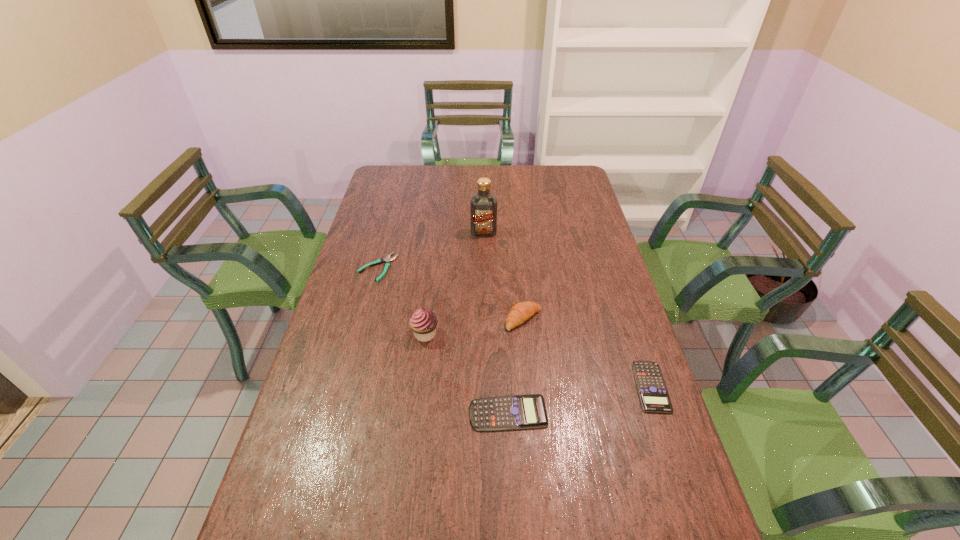
Identify the location of free point that keeps the calculators evenly spaced on the left. Image resolution: width=960 pixels, height=540 pixels. (350, 442).